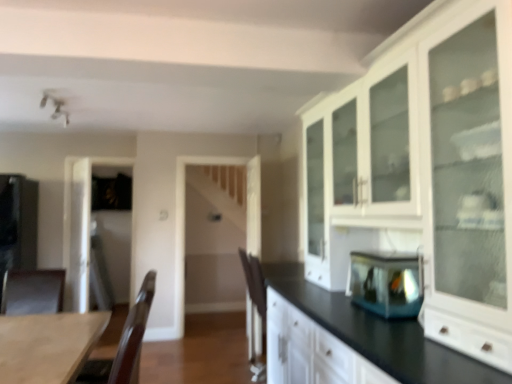
Where is `white glossy cabinet at upper right`? The width and height of the screenshot is (512, 384). white glossy cabinet at upper right is located at coordinates (428, 168).

This screenshot has height=384, width=512. What do you see at coordinates (110, 234) in the screenshot? I see `transparent glass door at left` at bounding box center [110, 234].

The image size is (512, 384). I want to click on white glossy cabinet at upper right, so click(428, 168).

Looking at this image, is brown leather armchair at lower left, the 1th armchair in the left-to-right sequence, positioned with its back to white glossy cabinet at upper right?

No, brown leather armchair at lower left, the 1th armchair in the left-to-right sequence,'s orientation is not away from white glossy cabinet at upper right.

Based on the photo, from the image's perspective, would you say brown leather armchair at lower left, marked as the second armchair in a right-to-left arrangement, is positioned over white glossy cabinet at upper right?

Incorrect, from the image's perspective, brown leather armchair at lower left, marked as the second armchair in a right-to-left arrangement, is lower than white glossy cabinet at upper right.

Considering the positions of points (5, 312) and (370, 159), is point (5, 312) closer to camera compared to point (370, 159)?

That is False.

From a real-world perspective, is brown leather armchair at lower left, marked as the second armchair in a right-to-left arrangement, physically located above or below white glossy cabinet at upper right?

From a real-world perspective, brown leather armchair at lower left, marked as the second armchair in a right-to-left arrangement, is physically below white glossy cabinet at upper right.

From a real-world perspective, does wooden table at lower left stand above transparent glass fish tank at center, the first appliance from the front?

Incorrect, from a real-world perspective, wooden table at lower left is lower than transparent glass fish tank at center, the first appliance from the front.

Can you tell me how much wooden table at lower left and transparent glass fish tank at center, positioned as the second appliance in back-to-front order, differ in facing direction?

The angular difference between wooden table at lower left and transparent glass fish tank at center, positioned as the second appliance in back-to-front order, is 1.65 degrees.

Would you consider wooden table at lower left to be distant from transparent glass fish tank at center, positioned as the second appliance in back-to-front order?

wooden table at lower left is positioned a significant distance from transparent glass fish tank at center, positioned as the second appliance in back-to-front order.

Which point is more forward, (16, 359) or (375, 256)?

The point (16, 359) is more forward.

Between brown wood armchair at left, the first armchair positioned from the right, and wooden table at lower left, which one has larger width?

With larger width is brown wood armchair at left, the first armchair positioned from the right.

Is point (153, 291) farther from camera compared to point (91, 341)?

That is True.

From the image's perspective, who appears lower, brown wood armchair at left, positioned as the second armchair in left-to-right order, or wooden table at lower left?

brown wood armchair at left, positioned as the second armchair in left-to-right order, appears lower in the image.

From a real-world perspective, is brown wood armchair at left, positioned as the second armchair in left-to-right order, positioned over wooden table at lower left based on gravity?

No.

Could you tell me if transparent glass door at left is facing white glossy cabinet at upper right?

No, transparent glass door at left is not facing towards white glossy cabinet at upper right.

Considering the relative positions of transparent glass door at left and white glossy cabinet at upper right in the image provided, is transparent glass door at left to the left of white glossy cabinet at upper right from the viewer's perspective?

Yes.

From a real-world perspective, is transparent glass door at left positioned above or below white glossy cabinet at upper right?

From a real-world perspective, transparent glass door at left is physically below white glossy cabinet at upper right.

In the scene shown: Considering the sizes of objects transparent glass door at left and white glossy cabinet at upper right in the image provided, who is taller, transparent glass door at left or white glossy cabinet at upper right?

transparent glass door at left.

Are white glossy cabinet at upper right and brown wood armchair at left, the first armchair positioned from the right, far apart?

Yes, white glossy cabinet at upper right and brown wood armchair at left, the first armchair positioned from the right, are quite far apart.

How different are the orientations of white glossy cabinet at upper right and brown wood armchair at left, positioned as the second armchair in left-to-right order, in degrees?

The angular difference between white glossy cabinet at upper right and brown wood armchair at left, positioned as the second armchair in left-to-right order, is 0.659 degrees.

Between white glossy cabinet at upper right and brown wood armchair at left, the first armchair positioned from the right, which one has smaller size?

With smaller size is brown wood armchair at left, the first armchair positioned from the right.

Is white glossy cabinet at upper right wider or thinner than brown wood armchair at left, positioned as the second armchair in left-to-right order?

Clearly, white glossy cabinet at upper right has more width compared to brown wood armchair at left, positioned as the second armchair in left-to-right order.

Which is behind, point (51, 292) or point (46, 340)?

Point (51, 292)

Considering the positions of objects brown leather armchair at lower left, marked as the second armchair in a right-to-left arrangement, and wooden table at lower left in the image provided, who is more to the right, brown leather armchair at lower left, marked as the second armchair in a right-to-left arrangement, or wooden table at lower left?

Positioned to the right is wooden table at lower left.

Find the location of a particular element. The width and height of the screenshot is (512, 384). table above the brown leather armchair at lower left, the 1th armchair in the left-to-right sequence (from a real-world perspective) is located at coordinates (48, 345).

Based on the photo, which object is closer to the camera taking this photo, brown leather armchair at lower left, marked as the second armchair in a right-to-left arrangement, or wooden table at lower left?

wooden table at lower left is closer to the camera.

Considering the sizes of objects brown leather armchair at lower left, marked as the second armchair in a right-to-left arrangement, and transparent glass fish tank at center, arranged as the 1th appliance when viewed from the right, in the image provided, who is bigger, brown leather armchair at lower left, marked as the second armchair in a right-to-left arrangement, or transparent glass fish tank at center, arranged as the 1th appliance when viewed from the right,?

brown leather armchair at lower left, marked as the second armchair in a right-to-left arrangement.

This screenshot has width=512, height=384. There is a transparent glass fish tank at center, the first appliance from the front. In order to click on the 1st armchair below it (from the image's perspective) in this screenshot , I will do `click(34, 292)`.

Does brown leather armchair at lower left, marked as the second armchair in a right-to-left arrangement, come behind transparent glass fish tank at center, acting as the second appliance starting from the left?

Yes, it is behind transparent glass fish tank at center, acting as the second appliance starting from the left.

Can you confirm if brown leather armchair at lower left, marked as the second armchair in a right-to-left arrangement, is wider than transparent glass fish tank at center, the first appliance from the front?

Indeed, brown leather armchair at lower left, marked as the second armchair in a right-to-left arrangement, has a greater width compared to transparent glass fish tank at center, the first appliance from the front.

The width and height of the screenshot is (512, 384). I want to click on the 2nd armchair to the left when counting from the white glossy cabinet at upper right, so (x=34, y=292).

Which appliance is the 1st one when counting from the back of the wooden table at lower left? Please provide its 2D coordinates.

[(386, 283)]

When comparing their distances from matte black refrigerator at left, arranged as the 2th appliance when viewed from the right, does brown wood armchair at left, the first armchair positioned from the right, or wooden table at lower left seem further?

The object further to matte black refrigerator at left, arranged as the 2th appliance when viewed from the right, is brown wood armchair at left, the first armchair positioned from the right.

Based on their spatial positions, is transparent glass door at left or brown wood armchair at left, positioned as the second armchair in left-to-right order, further from white glossy cabinet at upper right?

Among the two, transparent glass door at left is located further to white glossy cabinet at upper right.

From the image, which object appears to be farther from transparent glass door at left, brown wood armchair at left, positioned as the second armchair in left-to-right order, or white glossy cabinet at upper right?

white glossy cabinet at upper right is further to transparent glass door at left.

Based on their spatial positions, is white glossy cabinet at upper right or brown leather armchair at lower left, the 1th armchair in the left-to-right sequence, closer to transparent glass fish tank at center, arranged as the 1th appliance when viewed from the right?

Among the two, white glossy cabinet at upper right is located nearer to transparent glass fish tank at center, arranged as the 1th appliance when viewed from the right.

Looking at this image, which object lies nearer to the anchor point transparent glass fish tank at center, arranged as the 1th appliance when viewed from the right, white glossy cabinet at upper right or brown wood armchair at left, positioned as the second armchair in left-to-right order?

Based on the image, white glossy cabinet at upper right appears to be nearer to transparent glass fish tank at center, arranged as the 1th appliance when viewed from the right.

Based on their spatial positions, is transparent glass fish tank at center, positioned as the second appliance in back-to-front order, or brown leather armchair at lower left, the 1th armchair in the left-to-right sequence, further from transparent glass door at left?

transparent glass fish tank at center, positioned as the second appliance in back-to-front order, is further to transparent glass door at left.

Which object lies further to the anchor point white glossy cabinet at upper right, brown leather armchair at lower left, marked as the second armchair in a right-to-left arrangement, or transparent glass fish tank at center, positioned as the second appliance in back-to-front order?

brown leather armchair at lower left, marked as the second armchair in a right-to-left arrangement, is further to white glossy cabinet at upper right.

Estimate the real-world distances between objects in this image. Which object is closer to white glossy cabinet at upper right, matte black refrigerator at left, the first appliance when ordered from left to right, or transparent glass door at left?

Among the two, matte black refrigerator at left, the first appliance when ordered from left to right, is located nearer to white glossy cabinet at upper right.

The image size is (512, 384). I want to click on armchair positioned between wooden table at lower left and brown leather armchair at lower left, marked as the second armchair in a right-to-left arrangement, from near to far, so click(x=124, y=344).

The image size is (512, 384). Find the location of `table between brown wood armchair at left, positioned as the second armchair in left-to-right order, and white glossy cabinet at upper right`. table between brown wood armchair at left, positioned as the second armchair in left-to-right order, and white glossy cabinet at upper right is located at coordinates (48, 345).

The height and width of the screenshot is (384, 512). In order to click on armchair located between brown leather armchair at lower left, marked as the second armchair in a right-to-left arrangement, and white glossy cabinet at upper right in the left-right direction in this screenshot , I will do `click(124, 344)`.

Find the location of a particular element. This screenshot has width=512, height=384. appliance between brown leather armchair at lower left, the 1th armchair in the left-to-right sequence, and transparent glass door at left from front to back is located at coordinates (18, 223).